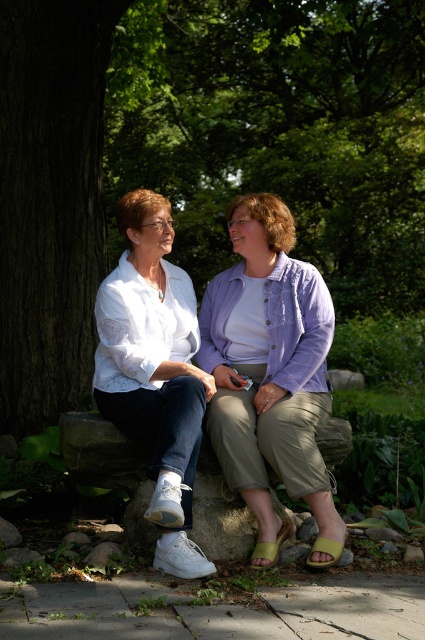
Question: Which of these objects is positioned closest to the white matte shirt at left?

Choices:
 (A) brown textured tree trunk at left
 (B) white cotton shirt at center

Answer: (B)

Question: Where is brown textured tree trunk at left located in relation to white cotton shirt at center in the image?

Choices:
 (A) right
 (B) left

Answer: (A)

Question: Among these points, which one is nearest to the camera?

Choices:
 (A) (119, 113)
 (B) (283, 211)

Answer: (B)

Question: Does white cotton shirt at center come in front of white matte shirt at left?

Choices:
 (A) no
 (B) yes

Answer: (A)

Question: Observing the image, what is the correct spatial positioning of white cotton shirt at center in reference to white matte shirt at left?

Choices:
 (A) right
 (B) left

Answer: (A)

Question: Considering the real-world distances, which object is closest to the white cotton shirt at center?

Choices:
 (A) white matte shirt at left
 (B) brown textured tree trunk at left

Answer: (A)